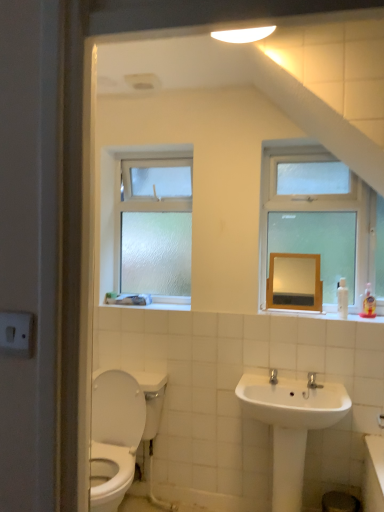
Question: Does white glossy sink at lower center appear on the left side of frosted glass window at upper left, marked as the 2th window in a right-to-left arrangement?

Choices:
 (A) no
 (B) yes

Answer: (A)

Question: Would you say white glossy sink at lower center is a long distance from frosted glass window at upper left, marked as the 2th window in a right-to-left arrangement?

Choices:
 (A) yes
 (B) no

Answer: (A)

Question: Could you tell me if white glossy sink at lower center is turned towards frosted glass window at upper left, marked as the 2th window in a right-to-left arrangement?

Choices:
 (A) yes
 (B) no

Answer: (B)

Question: Is white glossy sink at lower center thinner than frosted glass window at upper left, positioned as the 2th window in front-to-back order?

Choices:
 (A) yes
 (B) no

Answer: (B)

Question: From a real-world perspective, is white glossy sink at lower center physically below frosted glass window at upper left, positioned as the 2th window in front-to-back order?

Choices:
 (A) no
 (B) yes

Answer: (B)

Question: Do you think white glossy sink at lower center is within frosted glass window at upper left, the 1th window positioned from the left, or outside of it?

Choices:
 (A) outside
 (B) inside

Answer: (A)

Question: Is white glossy sink at lower center to the left or to the right of frosted glass window at upper left, the 1th window positioned from the left, in the image?

Choices:
 (A) left
 (B) right

Answer: (B)

Question: In terms of size, does white glossy sink at lower center appear bigger or smaller than frosted glass window at upper left, which appears as the first window when viewed from the back?

Choices:
 (A) big
 (B) small

Answer: (A)

Question: Is point (288, 410) closer or farther from the camera than point (99, 287)?

Choices:
 (A) farther
 (B) closer

Answer: (B)

Question: Is white glossy sink at lower center in front of or behind clear glass window at upper right, which appears as the 1th window when viewed from the front, in the image?

Choices:
 (A) behind
 (B) front

Answer: (B)

Question: Is white glossy sink at lower center inside the boundaries of clear glass window at upper right, which is counted as the second window, starting from the back, or outside?

Choices:
 (A) inside
 (B) outside

Answer: (B)

Question: From the image's perspective, is white glossy sink at lower center located above or below clear glass window at upper right, which is counted as the second window, starting from the back?

Choices:
 (A) above
 (B) below

Answer: (B)

Question: Is point (284, 377) positioned closer to the camera than point (283, 251)?

Choices:
 (A) farther
 (B) closer

Answer: (B)

Question: In the image, is white glossy sink at lower center positioned in front of or behind matte wooden mirror at upper center?

Choices:
 (A) front
 (B) behind

Answer: (A)

Question: Considering the positions of white glossy sink at lower center and matte wooden mirror at upper center in the image, is white glossy sink at lower center bigger or smaller than matte wooden mirror at upper center?

Choices:
 (A) small
 (B) big

Answer: (B)